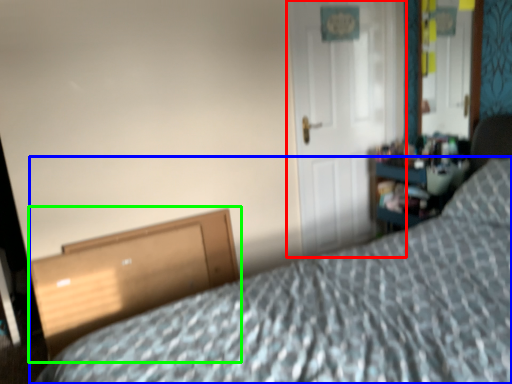
Question: Which object is the farthest from door (highlighted by a red box)? Choose among these: bed (highlighted by a blue box) or file cabinet (highlighted by a green box).

Choices:
 (A) bed
 (B) file cabinet

Answer: (A)